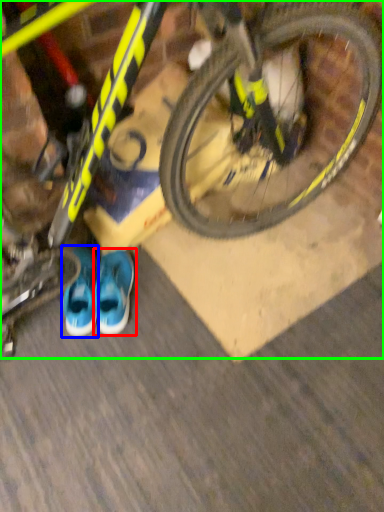
Question: Which object is the closest to the running shoe (highlighted by a red box)? Choose among these: footwear (highlighted by a blue box) or bicycle (highlighted by a green box).

Choices:
 (A) footwear
 (B) bicycle

Answer: (A)